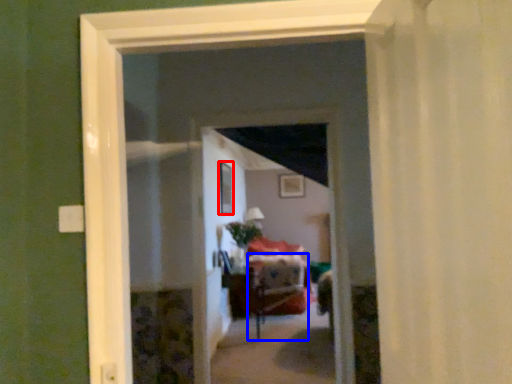
Question: Which of the following is the closest to the observer, window (highlighted by a red box) or furniture (highlighted by a blue box)?

Choices:
 (A) window
 (B) furniture

Answer: (A)